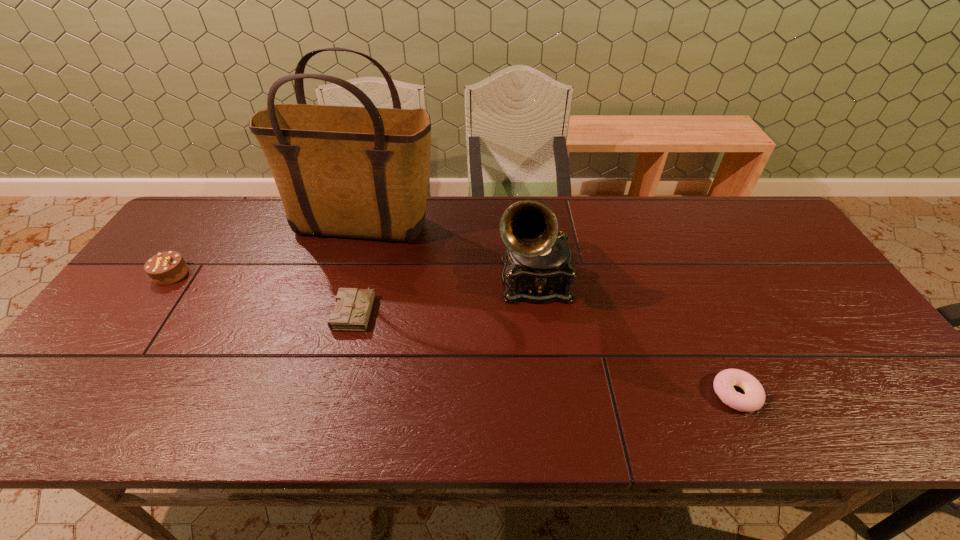
Find the location of a particular element. The height and width of the screenshot is (540, 960). vacant area that lies between the diary and the fourth object from left to right is located at coordinates (444, 295).

This screenshot has width=960, height=540. I want to click on free space between the chocolate cake and the tote bag, so click(x=268, y=251).

I want to click on empty space between the doughnut and the tallest object, so click(550, 310).

This screenshot has width=960, height=540. Identify the location of object that is the second closest to the phonograph record. (753, 399).

The height and width of the screenshot is (540, 960). I want to click on object identified as the fourth closest to the second tallest object, so click(168, 267).

Where is `free location that satisfies the following two spatial constraints: 1. on the horn of the doughnut; 2. on the right side of the phonograph record`? The width and height of the screenshot is (960, 540). free location that satisfies the following two spatial constraints: 1. on the horn of the doughnut; 2. on the right side of the phonograph record is located at coordinates (547, 394).

Identify the location of vacant region that satisfies the following two spatial constraints: 1. on the horn of the rightmost object; 2. on the left side of the phonograph record. The image size is (960, 540). (547, 394).

This screenshot has height=540, width=960. What are the coordinates of `vacant region that satisfies the following two spatial constraints: 1. on the front side of the rightmost object; 2. on the right side of the diary` in the screenshot? It's located at (333, 394).